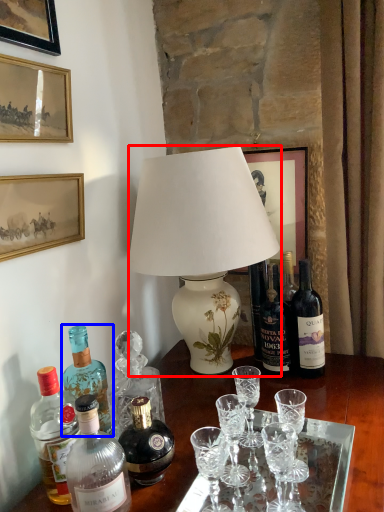
Question: Which object is further to the camera taking this photo, lamp (highlighted by a red box) or bottle (highlighted by a blue box)?

Choices:
 (A) lamp
 (B) bottle

Answer: (A)